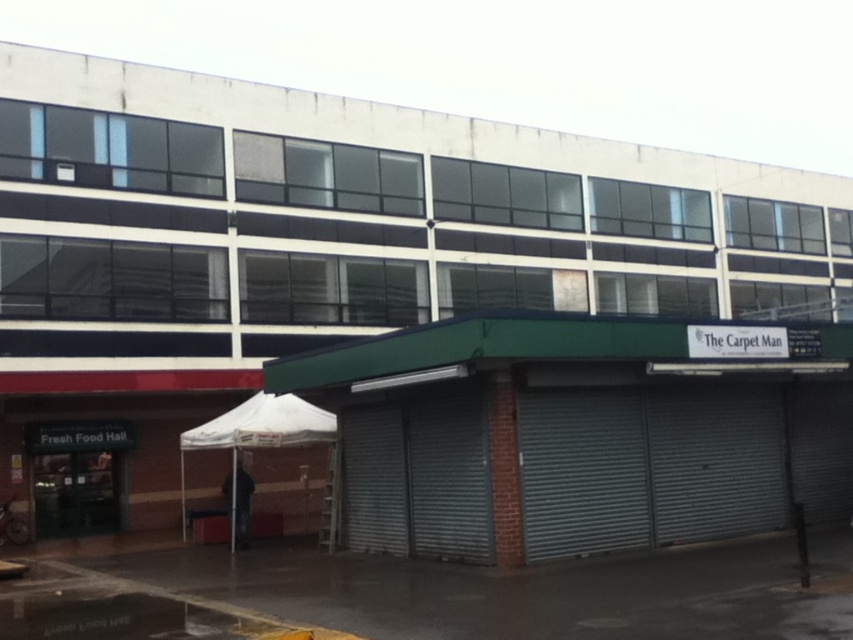
Question: Can you confirm if gray metallic garage door at center is thinner than white fabric canopy at lower left?

Choices:
 (A) yes
 (B) no

Answer: (B)

Question: Which of the following is the farthest from the observer?

Choices:
 (A) gray metallic garage door at center
 (B) white fabric canopy at lower left

Answer: (B)

Question: Does gray metallic garage door at center appear on the right side of white fabric canopy at lower left?

Choices:
 (A) no
 (B) yes

Answer: (B)

Question: Does gray metallic garage door at center have a lesser width compared to white fabric canopy at lower left?

Choices:
 (A) yes
 (B) no

Answer: (B)